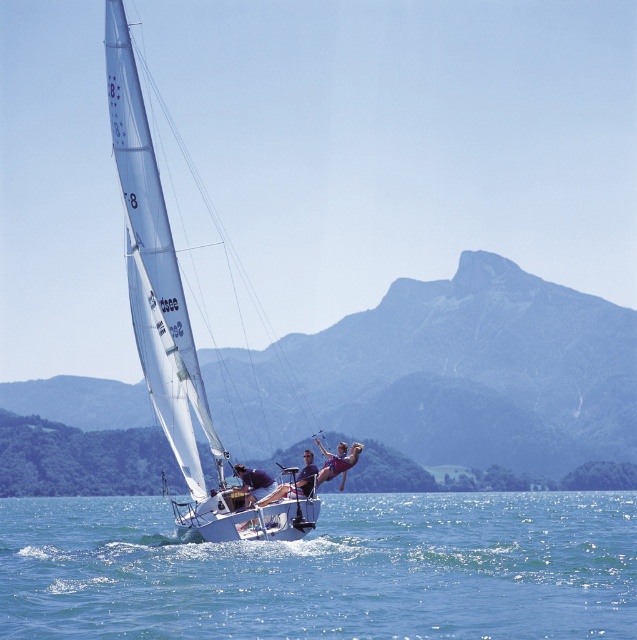
Which of these two, clear blue water at center or white matte sail at center, stands shorter?

white matte sail at center is shorter.

Does point (4, 529) come in front of point (215, 499)?

No, it is behind (215, 499).

Who is more distant from viewer, (559, 612) or (238, 538)?

The point (559, 612) is behind.

Locate an element on the screen. The height and width of the screenshot is (640, 637). clear blue water at center is located at coordinates (326, 570).

Can you confirm if white matte sail at center is positioned to the left of matte blue swimsuit at center?

Correct, you'll find white matte sail at center to the left of matte blue swimsuit at center.

What do you see at coordinates (173, 317) in the screenshot? I see `white matte sail at center` at bounding box center [173, 317].

Where is `white matte sail at center`? white matte sail at center is located at coordinates (173, 317).

Is point (311, 460) positioned behind point (354, 452)?

No, (311, 460) is closer to viewer.

In the scene shown: Is matte blue swimsuit at center to the left of purple fabric bikini at center from the viewer's perspective?

Yes, matte blue swimsuit at center is to the left of purple fabric bikini at center.

The width and height of the screenshot is (637, 640). I want to click on matte blue swimsuit at center, so pos(296,483).